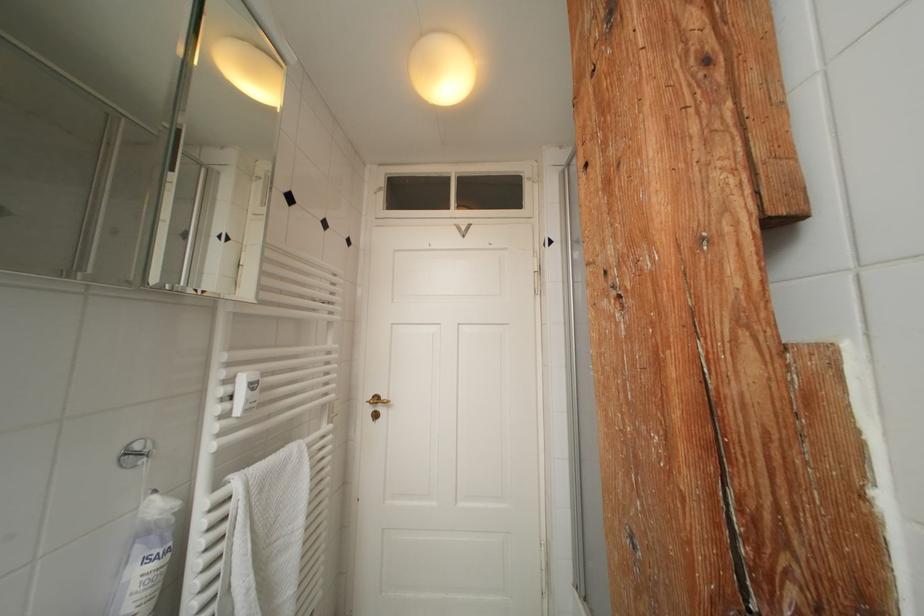
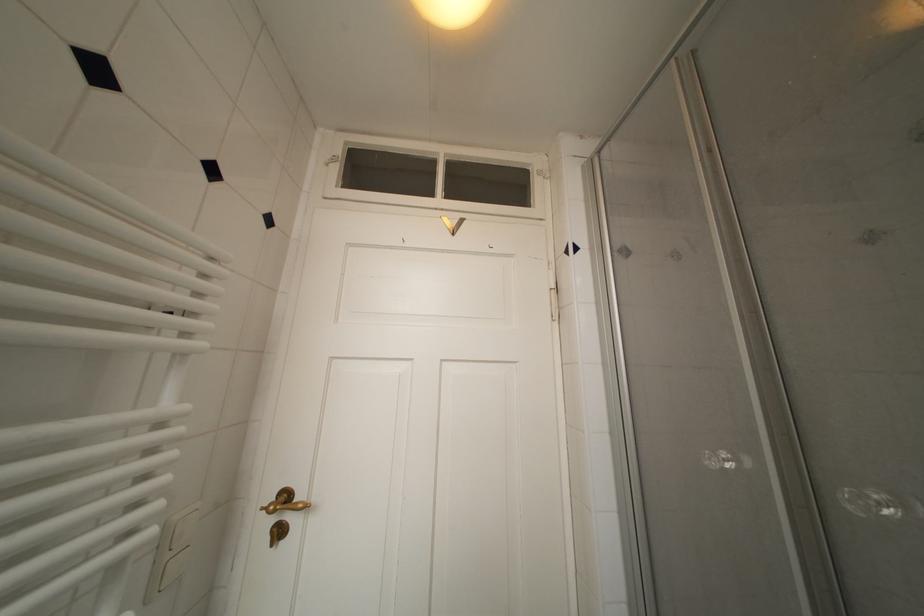
Question: The images are taken continuously from a first-person perspective. In which direction are you moving?

Choices:
 (A) Left
 (B) Right
 (C) Forward
 (D) Backward

Answer: (C)